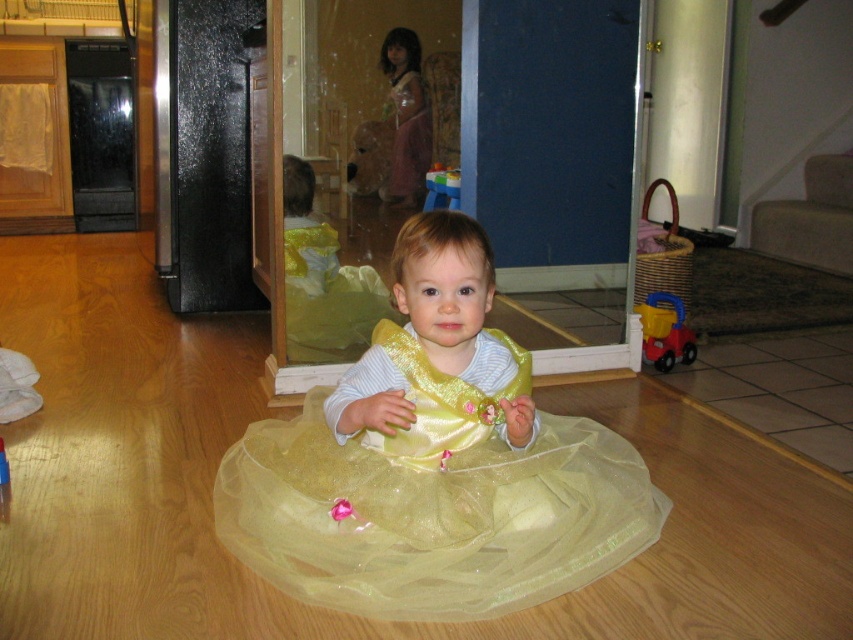
You are a parent trying to find your child who is wearing a shiny yellow tulle dress at center. You see the rubber red toy at center on the floor. Can you tell me if the dress is above or below the toy?

The shiny yellow tulle dress at center is located above the rubber red toy at center.

You are a parent trying to put away toys. You see the matte plastic toy truck at lower right and the blue plastic toy at center. If you want to place both toys into a storage bin that is 36 inches wide, will they fit side by side without overlapping?

The matte plastic toy truck at lower right and blue plastic toy at center are 36.67 inches apart from each other. Since the distance between them is greater than the storage bin width of 36 inches, placing them side by side would require overlapping or a larger bin.

You are a parent looking at the image. You want to know if the shiny yellow tulle dress at center is placed higher or lower than the blue plastic toy at center. Based on the scene, can you determine their positions?

The shiny yellow tulle dress at center is below the blue plastic toy at center, so the dress is lower than the toy.